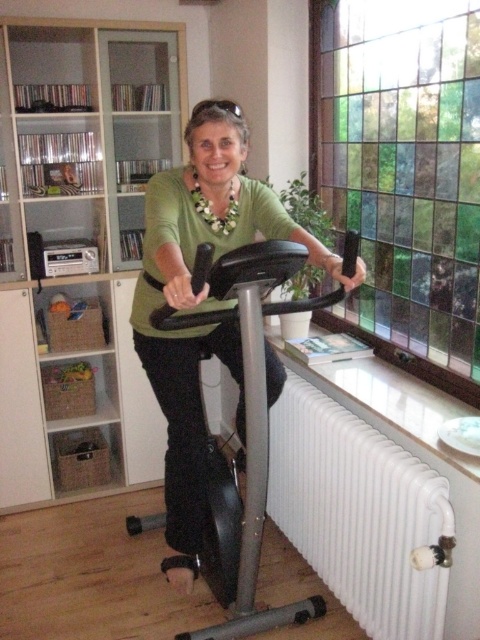
Question: Which of these objects is positioned closest to the white matte radiator at lower right?

Choices:
 (A) white glossy bookshelf at left
 (B) green matte shirt at center

Answer: (B)

Question: Is white glossy bookshelf at left closer to the viewer compared to white matte radiator at lower right?

Choices:
 (A) yes
 (B) no

Answer: (B)

Question: From the image, what is the correct spatial relationship of white glossy bookshelf at left in relation to green matte shirt at center?

Choices:
 (A) right
 (B) left

Answer: (B)

Question: Which of these objects is positioned farthest from the green matte shirt at center?

Choices:
 (A) white glossy bookshelf at left
 (B) white matte radiator at lower right

Answer: (A)

Question: Which of the following is the farthest from the observer?

Choices:
 (A) green matte shirt at center
 (B) white glossy bookshelf at left

Answer: (B)

Question: Where is green matte shirt at center located in relation to white matte radiator at lower right in the image?

Choices:
 (A) below
 (B) above

Answer: (B)